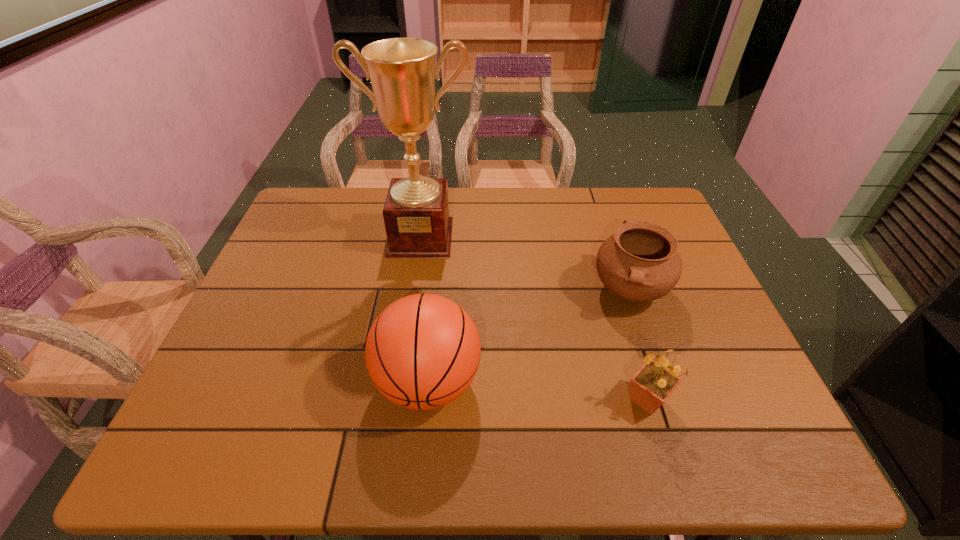
At what (x,y) coordinates should I click in order to perform the action: click on the farthest object. Please return your answer as a coordinate pair (x, y). This screenshot has width=960, height=540. Looking at the image, I should click on (402, 71).

Locate an element on the screen. the tallest object is located at coordinates (402, 71).

Find the location of `the third shortest object`. the third shortest object is located at coordinates (422, 352).

At what (x,y) coordinates should I click in order to perform the action: click on sunflower. Please return your answer as a coordinate pair (x, y). Looking at the image, I should click on (650, 387).

Where is `pottery`? The width and height of the screenshot is (960, 540). pottery is located at coordinates (640, 262).

Locate an element on the screen. The width and height of the screenshot is (960, 540). free region located 0.340m on the plaque of the trophy cup is located at coordinates (403, 355).

Locate an element on the screen. This screenshot has height=540, width=960. free region located 0.280m on the left of the basketball is located at coordinates (249, 382).

Where is `free location located on the front of the pottery`? free location located on the front of the pottery is located at coordinates (677, 429).

At what (x,y) coordinates should I click in order to perform the action: click on object located in the far edge section of the desktop. Please return your answer as a coordinate pair (x, y). This screenshot has height=540, width=960. Looking at the image, I should click on tap(402, 71).

The height and width of the screenshot is (540, 960). In order to click on basketball at the near edge in this screenshot , I will do `click(422, 352)`.